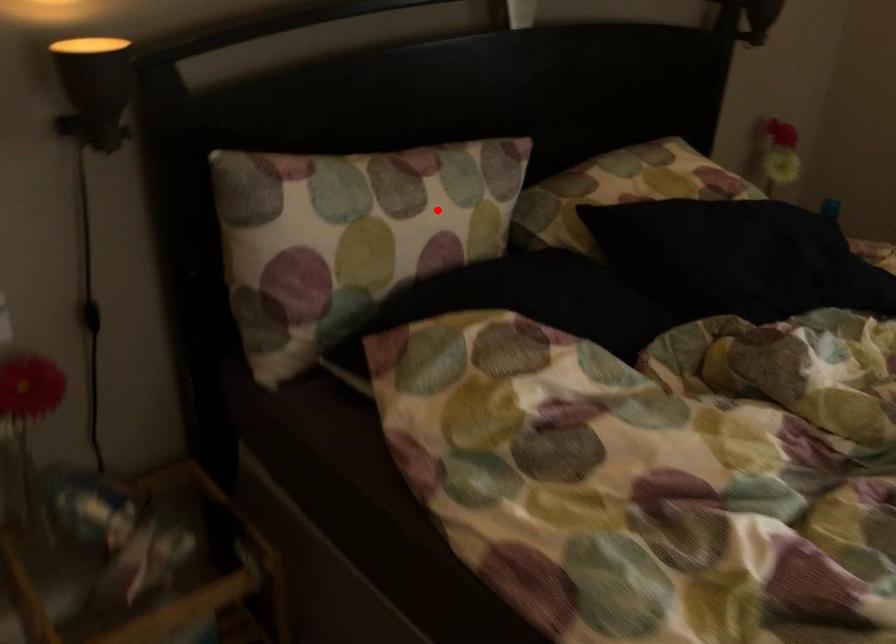
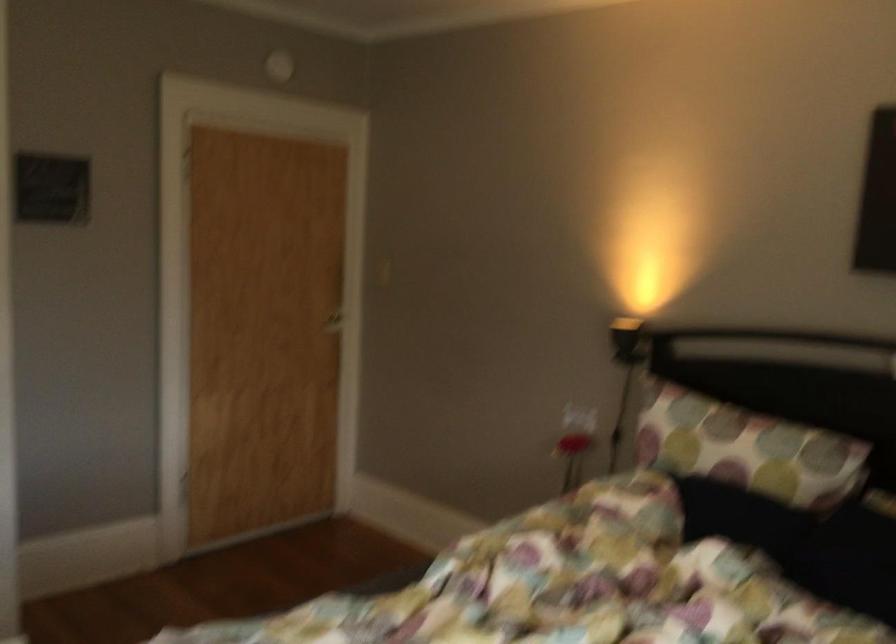
Question: I am providing you with two images of the same scene from different viewpoints. Image1 has a red point marked. In image2, the corresponding 3D location appears at what relative position? Reply with the corresponding letter.

Choices:
 (A) Closer
 (B) Farther

Answer: (B)